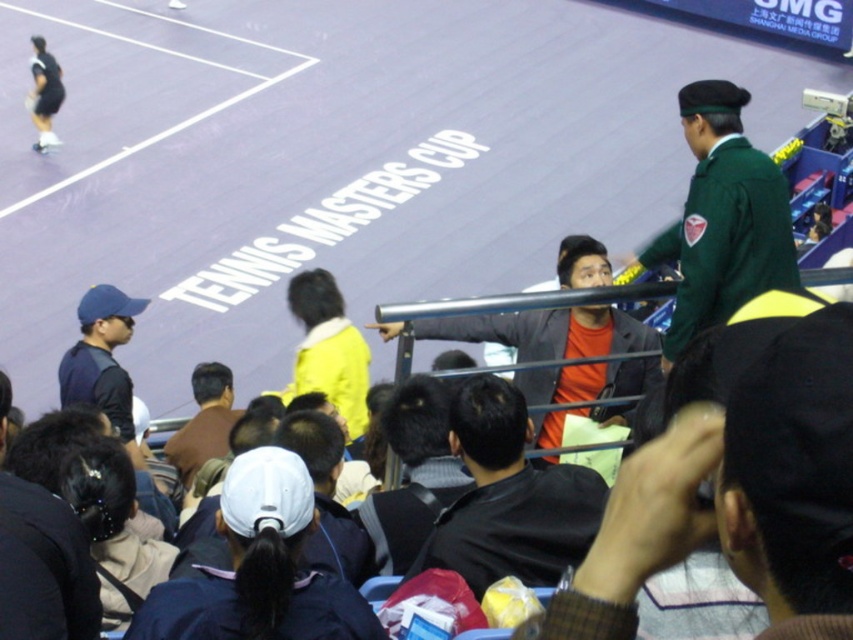
You are a photographer trying to capture a clear shot of the tennis match. You notice two caps in the crowd. The white fabric cap at center and the dark blue cap at left. Which cap is wider?

The white fabric cap at center might be wider than dark blue cap at left according to the description.

You are a photographer standing at the edge of the tennis court. You need to take a photo of the brown leather jacket at center without the dark blue jacket at lower left blocking it. Is this possible based on their positions?

The dark blue jacket at lower left is positioned over the brown leather jacket at center, so taking a photo of the brown leather jacket at center without the dark blue jacket at lower left blocking it would not be possible as it is covering it.

You are a photographer at the Tennis Masters Cup. You need to take a photo of the dark blue cap at left and the white fabric cap at center. Which cap is closer to the camera?

The white fabric cap at center is positioned under the dark blue cap at left, meaning the dark blue cap at left is closer to the camera.